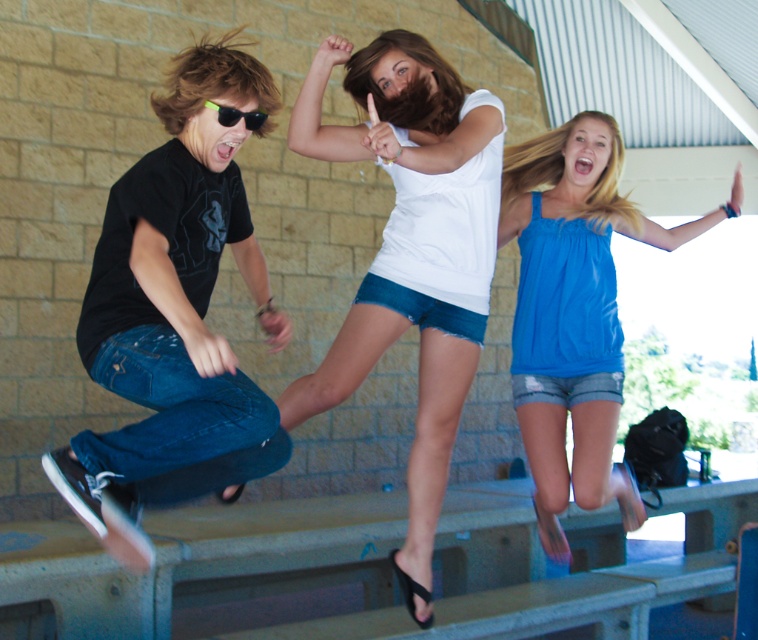
Who is higher up, black matte t-shirt at left or blue satin tank top at upper right?

black matte t-shirt at left is above.

Is black matte t-shirt at left to the right of blue satin tank top at upper right from the viewer's perspective?

Incorrect, black matte t-shirt at left is not on the right side of blue satin tank top at upper right.

Between point (130, 236) and point (594, 321), which one is positioned in front?

Point (130, 236)

Identify the location of black matte t-shirt at left. The width and height of the screenshot is (758, 640). (171, 307).

Can you confirm if white matte tank top at center is taller than blue satin tank top at upper right?

Indeed, white matte tank top at center has a greater height compared to blue satin tank top at upper right.

Which is more to the right, white matte tank top at center or blue satin tank top at upper right?

blue satin tank top at upper right is more to the right.

Between point (384, 342) and point (547, 132), which one is positioned behind?

The point (547, 132) is more distant.

Locate an element on the screen. The height and width of the screenshot is (640, 758). white matte tank top at center is located at coordinates (403, 259).

Is white matte tank top at center positioned at the back of black plastic sunglasses at left?

That is True.

Does white matte tank top at center appear over black plastic sunglasses at left?

Actually, white matte tank top at center is below black plastic sunglasses at left.

This screenshot has height=640, width=758. Describe the element at coordinates (403, 259) in the screenshot. I see `white matte tank top at center` at that location.

This screenshot has width=758, height=640. In order to click on white matte tank top at center in this screenshot , I will do `click(403, 259)`.